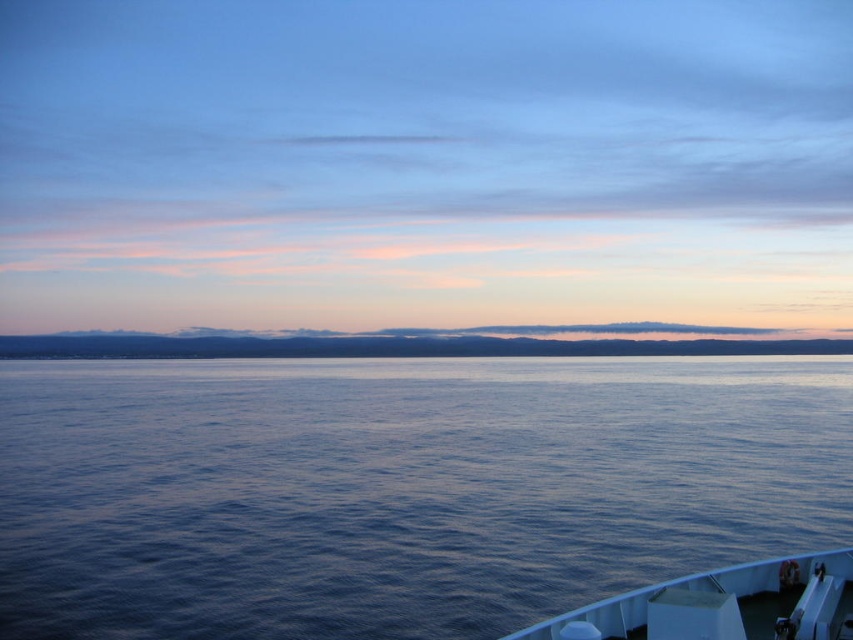
Question: Is white glossy boat at lower right closer to camera compared to blue matte horizon at center?

Choices:
 (A) no
 (B) yes

Answer: (B)

Question: Is blue smooth water at center further to camera compared to white glossy boat at lower right?

Choices:
 (A) yes
 (B) no

Answer: (A)

Question: From the image, what is the correct spatial relationship of blue smooth water at center in relation to white glossy boat at lower right?

Choices:
 (A) below
 (B) above

Answer: (A)

Question: Among these objects, which one is nearest to the camera?

Choices:
 (A) blue smooth water at center
 (B) white glossy boat at lower right
 (C) blue matte horizon at center

Answer: (B)

Question: Which object appears closest to the camera in this image?

Choices:
 (A) white glossy boat at lower right
 (B) blue matte horizon at center

Answer: (A)

Question: Which object is positioned farthest from the white glossy boat at lower right?

Choices:
 (A) blue smooth water at center
 (B) blue matte horizon at center

Answer: (B)